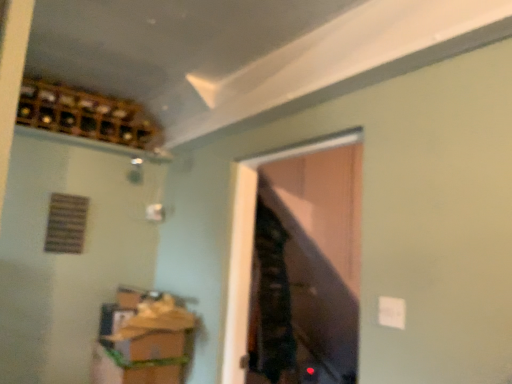
Question: In the image, is wooden wine rack at upper left positioned in front of or behind wooden cabinet at lower left?

Choices:
 (A) behind
 (B) front

Answer: (A)

Question: From a real-world perspective, relative to wooden cabinet at lower left, is wooden wine rack at upper left vertically above or below?

Choices:
 (A) below
 (B) above

Answer: (B)

Question: Estimate the real-world distances between objects in this image. Which object is farther from the transparent glass door at center?

Choices:
 (A) wooden wine rack at upper left
 (B) wooden cabinet at lower left

Answer: (A)

Question: Which object is positioned farthest from the transparent glass door at center?

Choices:
 (A) wooden wine rack at upper left
 (B) wooden cabinet at lower left

Answer: (A)